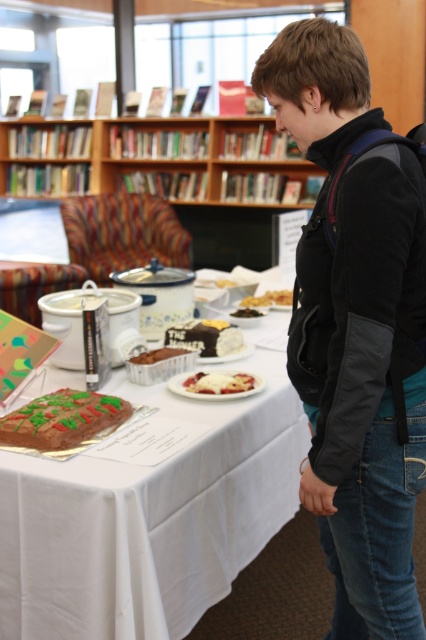
Can you confirm if green frosted cake at lower left is smaller than slightly browned cake at center?

No, green frosted cake at lower left is not smaller than slightly browned cake at center.

Who is more distant from viewer, (48, 394) or (273, 300)?

Point (273, 300)

Locate an element on the screen. The width and height of the screenshot is (426, 640). green frosted cake at lower left is located at coordinates (62, 419).

You are a GUI agent. You are given a task and a screenshot of the screen. Output one action in this format:
    pyautogui.click(x=<x>, y=<y>)
    Task: Click on the green frosted cake at lower left
    The width and height of the screenshot is (426, 640).
    Given the screenshot: What is the action you would take?
    pyautogui.click(x=62, y=419)

Does white creamy cake at center have a smaller size compared to slightly browned cake at center?

Indeed, white creamy cake at center has a smaller size compared to slightly browned cake at center.

Is point (204, 376) positioned before point (273, 296)?

Yes, point (204, 376) is in front of point (273, 296).

Identify the location of white creamy cake at center. The width and height of the screenshot is (426, 640). (218, 381).

Does green frosted cake at lower left have a lesser width compared to white creamy cake at center?

Incorrect, green frosted cake at lower left's width is not less than white creamy cake at center's.

How distant is green frosted cake at lower left from white creamy cake at center?

They are 13.95 inches apart.

Is point (71, 433) closer to camera compared to point (249, 381)?

That is True.

What are the coordinates of `green frosted cake at lower left` in the screenshot? It's located at (62, 419).